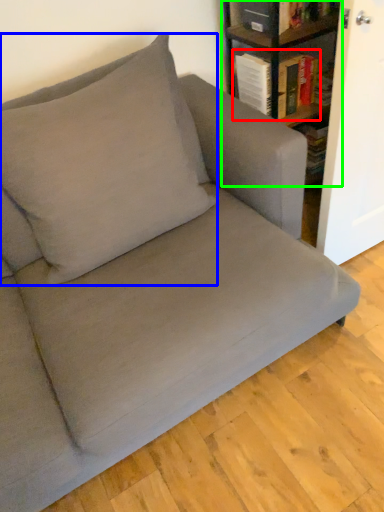
Question: Based on their relative distances, which object is farther from book (highlighted by a red box)? Choose from throw pillow (highlighted by a blue box) and shelf (highlighted by a green box).

Choices:
 (A) throw pillow
 (B) shelf

Answer: (A)